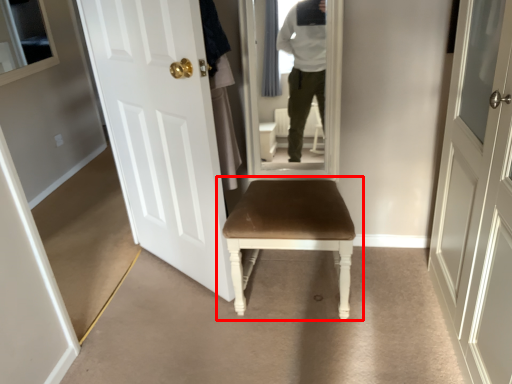
Question: From the image's perspective, considering the relative positions of chair (annotated by the red box) and door in the image provided, where is chair (annotated by the red box) located with respect to the staircase?

Choices:
 (A) above
 (B) below

Answer: (B)